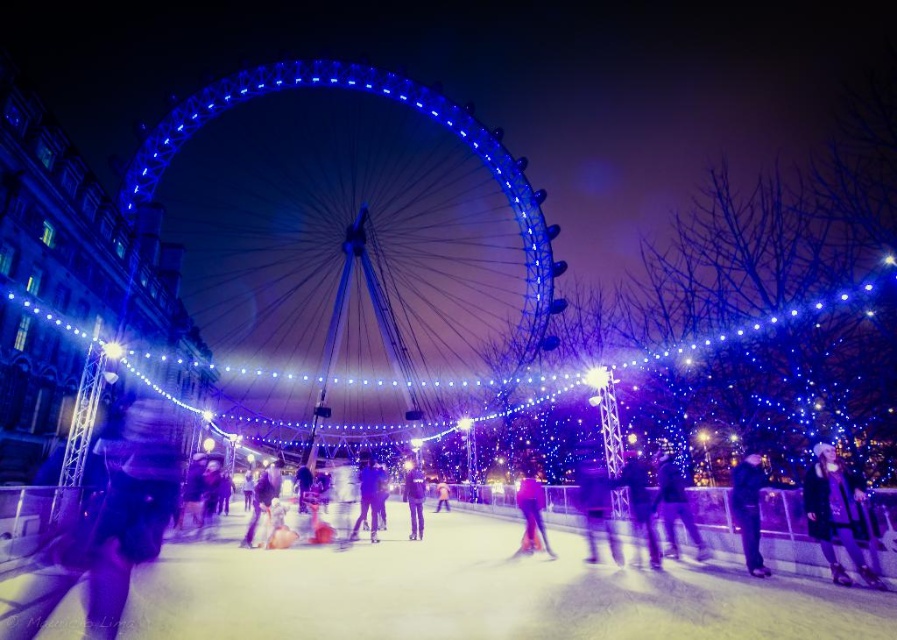
Question: Which is farther from the matte pink pants at center?

Choices:
 (A) matte purple pants at center
 (B) velvet purple coat at lower right
 (C) pink fabric at center

Answer: (C)

Question: Is the position of dark blue jacket at center more distant than that of purple matte jacket at center?

Choices:
 (A) no
 (B) yes

Answer: (A)

Question: Can you confirm if dark blue jacket at center is thinner than matte purple pants at center?

Choices:
 (A) no
 (B) yes

Answer: (A)

Question: Observing the image, what is the correct spatial positioning of blue illuminated ferris wheel at center in reference to pink fabric at center?

Choices:
 (A) right
 (B) left

Answer: (B)

Question: Estimate the real-world distances between objects in this image. Which object is closer to the purple matte jacket at center?

Choices:
 (A) matte purple pants at center
 (B) dark blue fabric jacket at center
 (C) dark blue jacket at center

Answer: (A)

Question: Among these objects, which one is nearest to the camera?

Choices:
 (A) matte purple pants at center
 (B) blue illuminated ferris wheel at center
 (C) purple matte jacket at center
 (D) matte black jacket at center

Answer: (D)